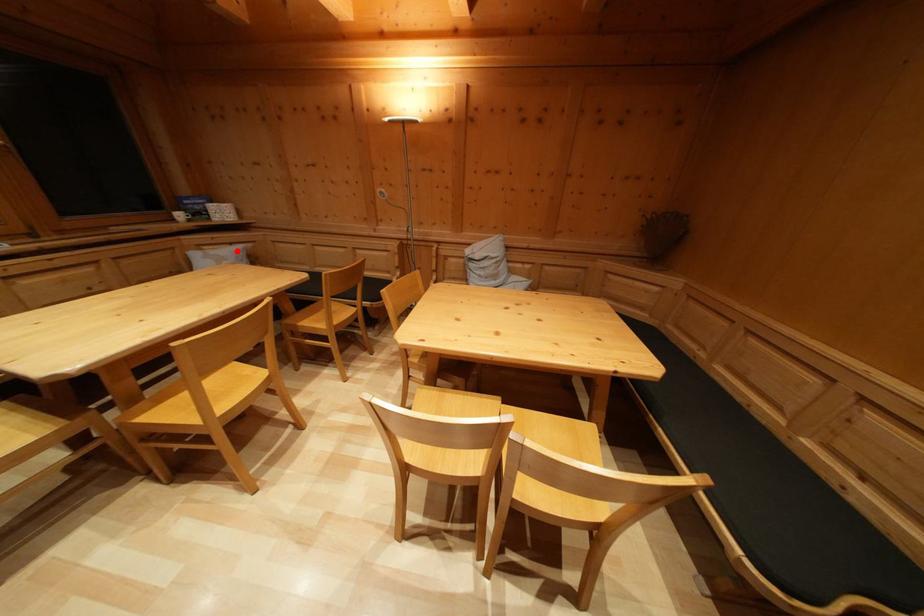
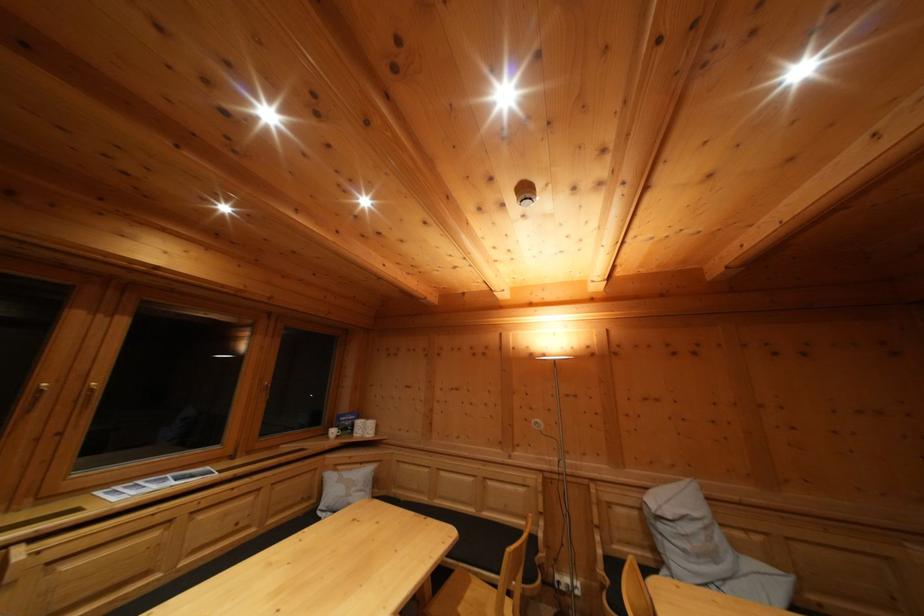
The point at the highlighted location is marked in the first image. Where is the corresponding point in the second image?

(368, 469)